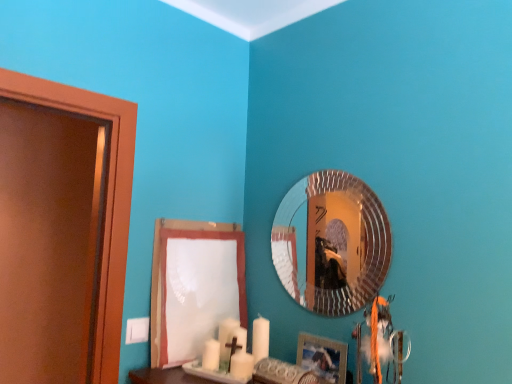
Question: From a real-world perspective, is white paper at lower center beneath silver textured mirror at upper center?

Choices:
 (A) yes
 (B) no

Answer: (A)

Question: Is white paper at lower center far from silver textured mirror at upper center?

Choices:
 (A) no
 (B) yes

Answer: (A)

Question: Is silver textured mirror at upper center completely or partially inside white paper at lower center?

Choices:
 (A) yes
 (B) no

Answer: (B)

Question: Can you confirm if white paper at lower center is thinner than silver textured mirror at upper center?

Choices:
 (A) no
 (B) yes

Answer: (A)

Question: Is white paper at lower center positioned in front of silver textured mirror at upper center?

Choices:
 (A) yes
 (B) no

Answer: (B)

Question: Considering the relative positions of white paper at lower center and silver textured mirror at upper center in the image provided, is white paper at lower center to the left of silver textured mirror at upper center from the viewer's perspective?

Choices:
 (A) no
 (B) yes

Answer: (B)

Question: Considering the relative positions of silver textured mirror at upper center and wooden picture frame at lower right in the image provided, is silver textured mirror at upper center behind wooden picture frame at lower right?

Choices:
 (A) no
 (B) yes

Answer: (B)

Question: Can you confirm if silver textured mirror at upper center is positioned to the left of wooden picture frame at lower right?

Choices:
 (A) no
 (B) yes

Answer: (A)

Question: Is silver textured mirror at upper center positioned far away from wooden picture frame at lower right?

Choices:
 (A) yes
 (B) no

Answer: (B)

Question: Does silver textured mirror at upper center appear on the right side of wooden picture frame at lower right?

Choices:
 (A) no
 (B) yes

Answer: (B)

Question: Considering the relative sizes of silver textured mirror at upper center and wooden picture frame at lower right in the image provided, is silver textured mirror at upper center taller than wooden picture frame at lower right?

Choices:
 (A) yes
 (B) no

Answer: (A)

Question: Is silver textured mirror at upper center looking in the opposite direction of wooden picture frame at lower right?

Choices:
 (A) yes
 (B) no

Answer: (B)

Question: Can you confirm if silver textured mirror at upper center is bigger than white paper at lower center?

Choices:
 (A) yes
 (B) no

Answer: (B)